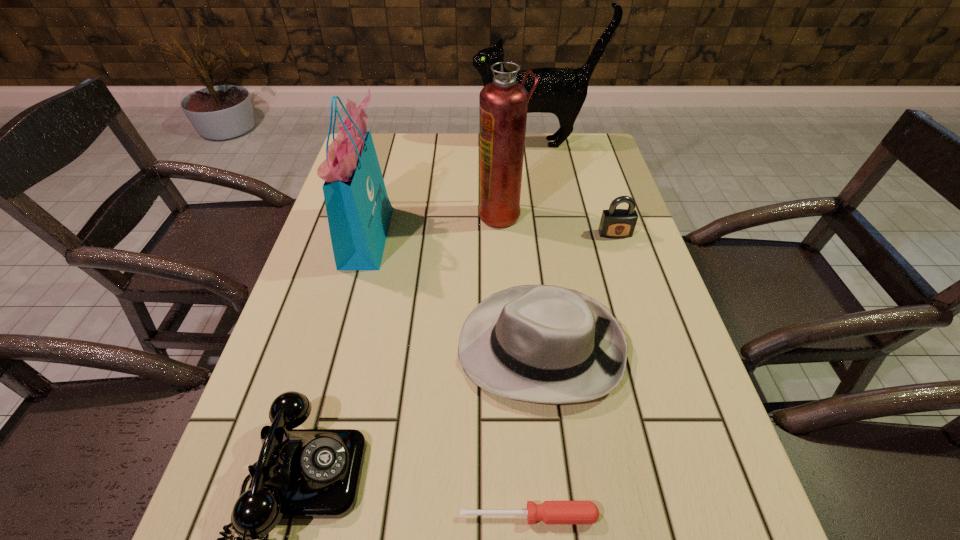
This screenshot has height=540, width=960. In order to click on free space in the image that satisfies the following two spatial constraints: 1. on the face of the cat; 2. on the front side of the shortest object in this screenshot , I will do `click(598, 516)`.

You are a GUI agent. You are given a task and a screenshot of the screen. Output one action in this format:
    pyautogui.click(x=<x>, y=<y>)
    Task: Click on the vacant region that satisfies the following two spatial constraints: 1. on the side of the shortest object with the label; 2. on the right side of the fire extinguisher
    This screenshot has width=960, height=540.
    Given the screenshot: What is the action you would take?
    pyautogui.click(x=518, y=516)